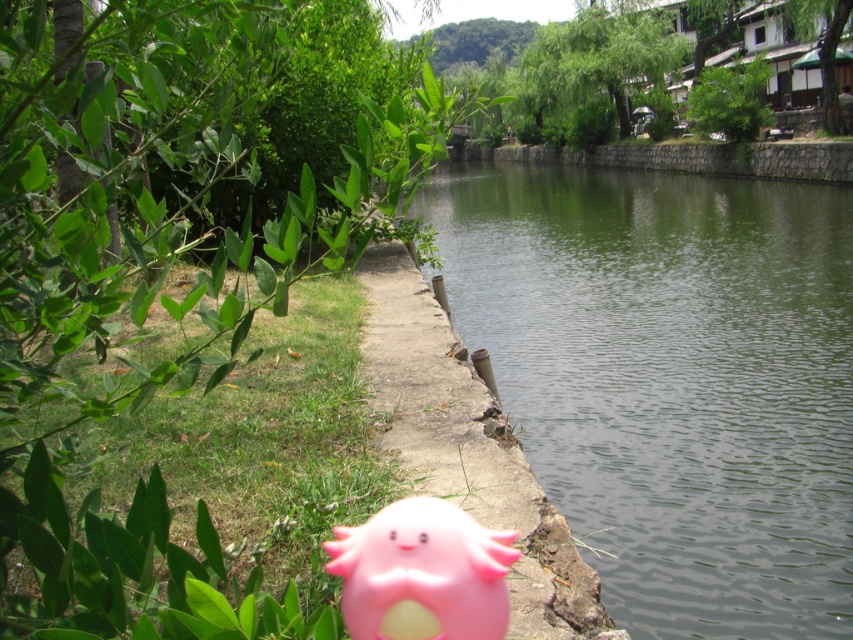
Question: Which point is closer to the camera?

Choices:
 (A) (621, 564)
 (B) (376, 621)
 (C) (440, 433)

Answer: (B)

Question: Is concrete at center to the right of pink rubber toy at lower center from the viewer's perspective?

Choices:
 (A) no
 (B) yes

Answer: (B)

Question: Which is nearer to the concrete at center?

Choices:
 (A) green stone river at center
 (B) pink rubber toy at lower center

Answer: (B)

Question: Can you confirm if green stone river at center is positioned below concrete at center?

Choices:
 (A) yes
 (B) no

Answer: (B)

Question: Which point appears farthest from the camera in this image?

Choices:
 (A) (463, 557)
 (B) (817, 289)
 (C) (440, 346)

Answer: (B)

Question: Is green stone river at center smaller than pink rubber toy at lower center?

Choices:
 (A) yes
 (B) no

Answer: (B)